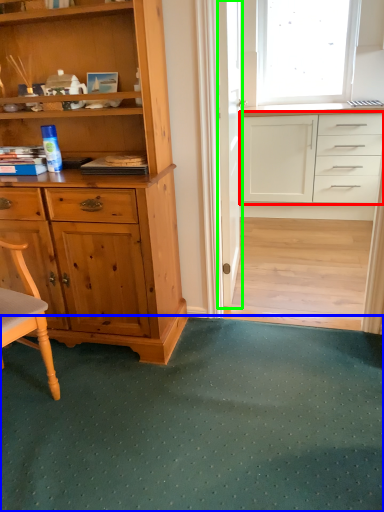
Question: Based on their relative distances, which object is farther from cabinetry (highlighted by a red box)? Choose from doormat (highlighted by a blue box) and screen door (highlighted by a green box).

Choices:
 (A) doormat
 (B) screen door

Answer: (A)